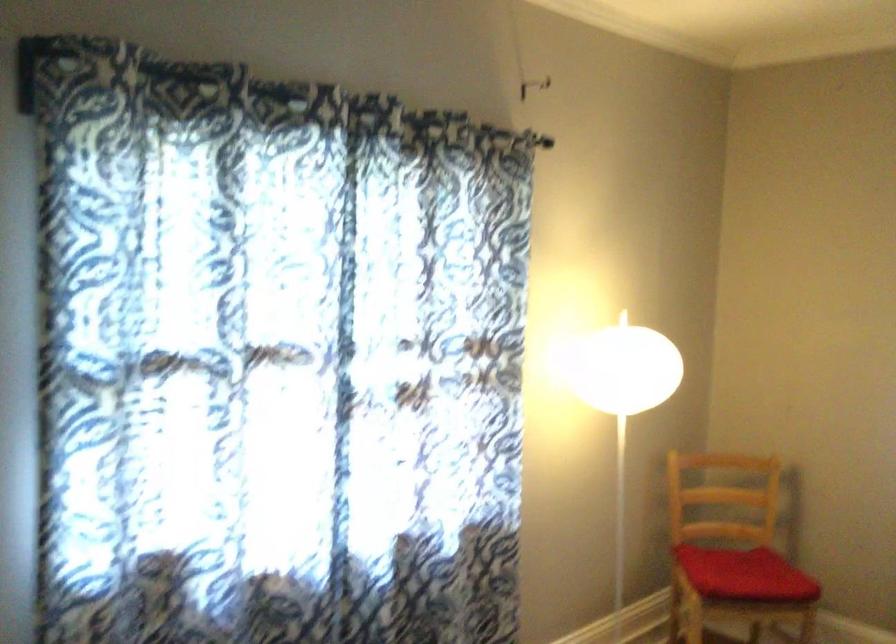
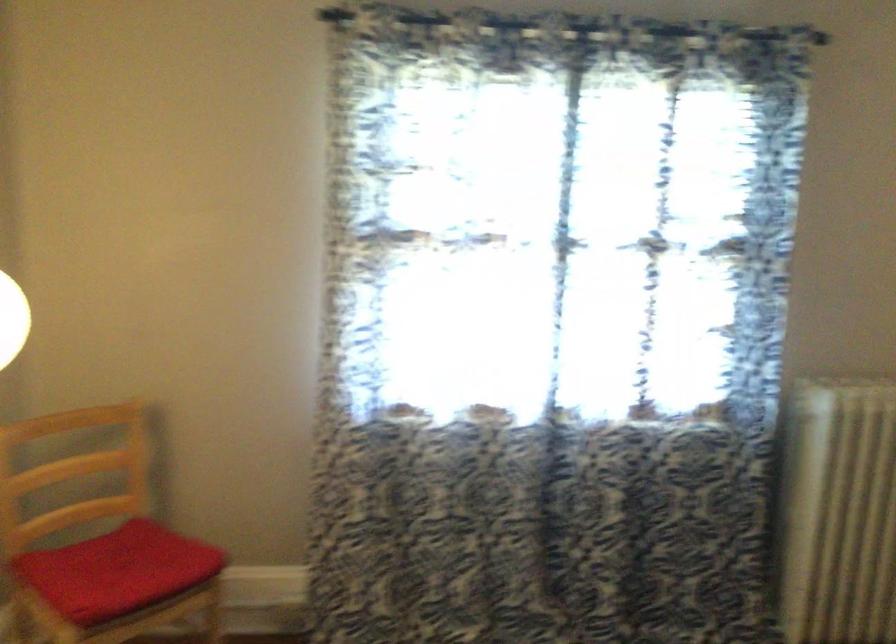
Question: The camera is either moving clockwise (left) or counter-clockwise (right) around the object. The first image is from the beginning of the video and the second image is from the end. Is the camera moving left or right when shooting the video?

Choices:
 (A) Left
 (B) Right

Answer: (A)